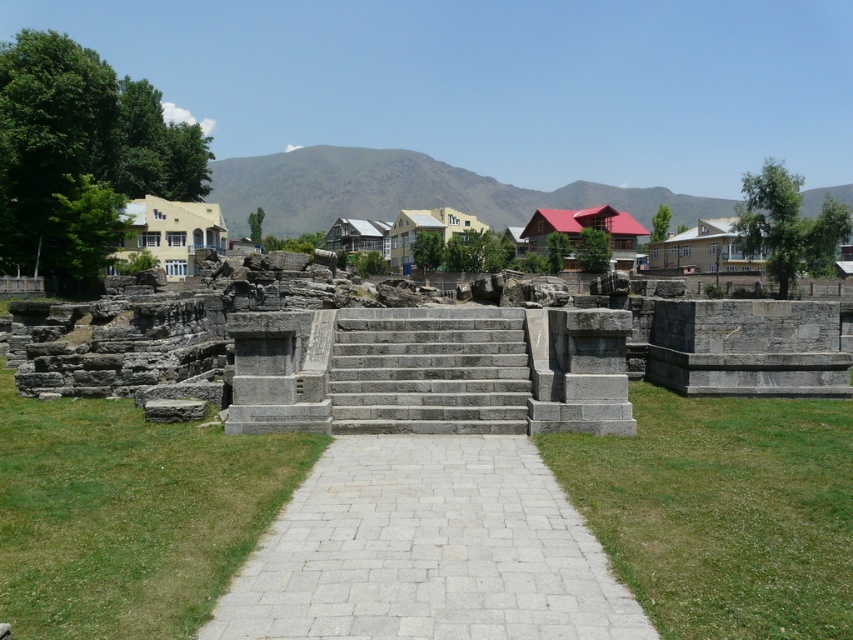
Is gray stone path at center positioned before green grass at lower right?

That is False.

Which is behind, point (299, 557) or point (805, 461)?

Point (805, 461)

Image resolution: width=853 pixels, height=640 pixels. I want to click on gray stone path at center, so click(428, 550).

Find the location of a particular element. gray stone path at center is located at coordinates (428, 550).

Who is more distant from viewer, (393, 509) or (474, 364)?

The point (474, 364) is behind.

You are a GUI agent. You are given a task and a screenshot of the screen. Output one action in this format:
    pyautogui.click(x=<x>, y=<y>)
    Task: Click on the gray stone path at center
    
    Given the screenshot: What is the action you would take?
    pyautogui.click(x=428, y=550)

Does gray stone path at center appear under green grass at center?

Yes.

Is gray stone path at center positioned before green grass at center?

No, it is behind green grass at center.

Locate an element on the screen. The height and width of the screenshot is (640, 853). gray stone path at center is located at coordinates (428, 550).